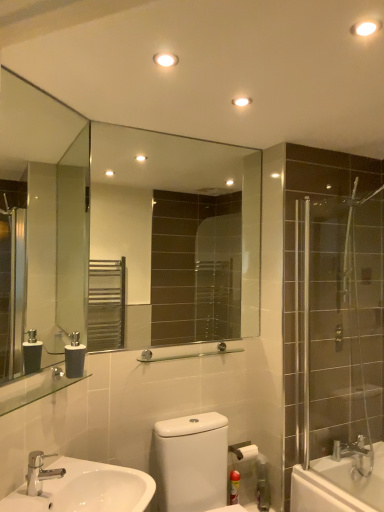
Describe the element at coordinates (339, 327) in the screenshot. I see `clear glass shower door at right` at that location.

Measure the distance between point (208, 462) and camera.

The distance of point (208, 462) from camera is 6.72 feet.

The image size is (384, 512). Describe the element at coordinates (87, 490) in the screenshot. I see `white glossy sink at lower left` at that location.

Find the location of a particular element. This screenshot has height=512, width=384. clear glass towel bar at center, the second balustrade positioned from the left is located at coordinates (187, 354).

Locate an element on the screen. This screenshot has height=512, width=384. clear glass shower door at right is located at coordinates tap(339, 327).

Is white glossy sink at lower left a part of white glossy toilet at lower center?

No, white glossy toilet at lower center does not contain white glossy sink at lower left.

From the image's perspective, which object appears higher, white glossy toilet at lower center or white glossy sink at lower left?

white glossy sink at lower left, from the image's perspective.

Could you tell me if white glossy toilet at lower center is facing white glossy sink at lower left?

No, white glossy toilet at lower center is not aimed at white glossy sink at lower left.

Between clear glass towel bar at center, placed as the 1th balustrade when sorted from right to left, and white glossy sink at lower left, which one has more height?

white glossy sink at lower left is taller.

From a real-world perspective, is clear glass towel bar at center, the second balustrade positioned from the left, over white glossy sink at lower left?

Yes, from a real-world perspective, clear glass towel bar at center, the second balustrade positioned from the left, is on top of white glossy sink at lower left.

Which object is further away from the camera taking this photo, clear glass towel bar at center, placed as the 1th balustrade when sorted from right to left, or white glossy sink at lower left?

clear glass towel bar at center, placed as the 1th balustrade when sorted from right to left, is more distant.

Which is farther, [142,352] or [51,483]?

The point [142,352] is farther from the camera.

Considering the sizes of objects white glossy toilet at lower center and matte plastic canister at lower right in the image provided, who is taller, white glossy toilet at lower center or matte plastic canister at lower right?

white glossy toilet at lower center.

What are the coordinates of `toiletry lying behind the white glossy toilet at lower center` in the screenshot? It's located at (234, 487).

Does white glossy toilet at lower center have a greater width compared to matte plastic canister at lower right?

Correct, the width of white glossy toilet at lower center exceeds that of matte plastic canister at lower right.

Considering the sizes of objects white glossy toilet at lower center and matte plastic canister at lower right in the image provided, who is bigger, white glossy toilet at lower center or matte plastic canister at lower right?

white glossy toilet at lower center is bigger.

Is clear glass mirror at center, the 1th mirror viewed from the right, wider or thinner than white glossy sink at lower left?

Clearly, clear glass mirror at center, the 1th mirror viewed from the right, has less width compared to white glossy sink at lower left.

Between clear glass mirror at center, arranged as the first mirror when viewed from the back, and white glossy sink at lower left, which one is positioned in front?

Result: white glossy sink at lower left is in front.

Is clear glass mirror at center, the 1th mirror viewed from the right, far from white glossy sink at lower left?

Yes, clear glass mirror at center, the 1th mirror viewed from the right, is far from white glossy sink at lower left.

In the scene shown: Is clear glass mirror at center, arranged as the first mirror when viewed from the back, at the left side of white glossy sink at lower left?

No.

I want to click on tap in front of the clear glass shower door at right, so click(40, 472).

How different are the orientations of clear glass shower door at right and chrome metallic faucet at lower left in degrees?

134 degrees separate the facing orientations of clear glass shower door at right and chrome metallic faucet at lower left.

From the image's perspective, who appears lower, clear glass shower door at right or chrome metallic faucet at lower left?

chrome metallic faucet at lower left, from the image's perspective.

From the picture: Which object is further away from the camera, clear glass shower door at right or chrome metallic faucet at lower left?

clear glass shower door at right.

Can you confirm if clear glass shower door at right is smaller than white glossy toilet at lower center?

Correct, clear glass shower door at right occupies less space than white glossy toilet at lower center.

Considering the relative positions of clear glass shower door at right and white glossy toilet at lower center in the image provided, is clear glass shower door at right to the left of white glossy toilet at lower center from the viewer's perspective?

Incorrect, clear glass shower door at right is not on the left side of white glossy toilet at lower center.

This screenshot has height=512, width=384. Identify the location of screen door above the white glossy toilet at lower center (from a real-world perspective). (339, 327).

Based on the photo, considering the positions of objects white glossy sink at lower left and clear glass shower door at right in the image provided, who is more to the right, white glossy sink at lower left or clear glass shower door at right?

clear glass shower door at right.

Locate an element on the screen. sink in front of the clear glass shower door at right is located at coordinates (87, 490).

Is white glossy sink at lower left closer to the viewer compared to clear glass shower door at right?

Yes, the depth of white glossy sink at lower left is less than that of clear glass shower door at right.

From a real-world perspective, is white glossy sink at lower left above or below clear glass shower door at right?

Clearly, from a real-world perspective, white glossy sink at lower left is below clear glass shower door at right.

This screenshot has height=512, width=384. Identify the location of gray located underneath the white glossy sink at lower left (from a real-world perspective). (191, 462).

Image resolution: width=384 pixels, height=512 pixels. I want to click on balustrade that is on the right side of white glossy sink at lower left, so click(x=187, y=354).

Considering their positions, is chrome metallic faucet at lower left positioned further to clear glass shelf at lower left, which ranks as the second balustrade in back-to-front order, than clear glass mirror at upper left, acting as the second mirror starting from the right?

clear glass mirror at upper left, acting as the second mirror starting from the right.

When comparing their distances from white glossy toilet at lower center, does chrome metallic faucet at lower left or matte plastic canister at lower right seem closer?

matte plastic canister at lower right lies closer to white glossy toilet at lower center than the other object.

When comparing their distances from clear glass shower door at right, does chrome metallic faucet at lower left or clear glass towel bar at center, the second balustrade positioned from the left, seem closer?

Based on the image, clear glass towel bar at center, the second balustrade positioned from the left, appears to be nearer to clear glass shower door at right.

Estimate the real-world distances between objects in this image. Which object is closer to clear glass shelf at lower left, acting as the 1th balustrade starting from the front, white glossy sink at lower left or white glossy toilet at lower center?

Among the two, white glossy sink at lower left is located nearer to clear glass shelf at lower left, acting as the 1th balustrade starting from the front.

When comparing their distances from white glossy toilet at lower center, does matte plastic canister at lower right or clear glass shelf at lower left, which ranks as the 2th balustrade in right-to-left order, seem further?

Based on the image, clear glass shelf at lower left, which ranks as the 2th balustrade in right-to-left order, appears to be further to white glossy toilet at lower center.

Based on the photo, when comparing their distances from matte gray soap dispenser at lower left, does matte plastic canister at lower right or chrome metallic faucet at lower left seem further?

matte plastic canister at lower right lies further to matte gray soap dispenser at lower left than the other object.

Based on their spatial positions, is chrome metallic faucet at lower left or clear glass shelf at lower left, which ranks as the second balustrade in back-to-front order, closer to clear glass shower door at right?

The object closer to clear glass shower door at right is clear glass shelf at lower left, which ranks as the second balustrade in back-to-front order.

Considering their positions, is matte gray soap dispenser at lower left positioned further to white glossy sink at lower left than clear glass mirror at center, which is the second mirror in front-to-back order?

clear glass mirror at center, which is the second mirror in front-to-back order, is positioned further to the anchor white glossy sink at lower left.

The width and height of the screenshot is (384, 512). What are the coordinates of `tap that lies between matte gray soap dispenser at lower left and matte plastic canister at lower right from top to bottom` in the screenshot? It's located at (40, 472).

The width and height of the screenshot is (384, 512). I want to click on sink located between chrome metallic faucet at lower left and white glossy toilet at lower center in the left-right direction, so click(x=87, y=490).

Locate an element on the screen. The width and height of the screenshot is (384, 512). soap dispenser that lies between clear glass mirror at upper left, arranged as the 1th mirror when viewed from the left, and clear glass shelf at lower left, which ranks as the 2th balustrade in right-to-left order, from top to bottom is located at coordinates (74, 357).

Where is `balustrade between matte gray soap dispenser at lower left and clear glass shower door at right`? The height and width of the screenshot is (512, 384). balustrade between matte gray soap dispenser at lower left and clear glass shower door at right is located at coordinates (187, 354).